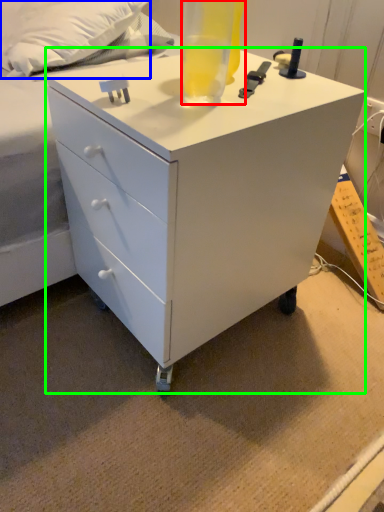
Question: Which object is positioned closest to beverage (highlighted by a red box)? Select from pillow (highlighted by a blue box) and chest of drawers (highlighted by a green box).

Choices:
 (A) pillow
 (B) chest of drawers

Answer: (B)